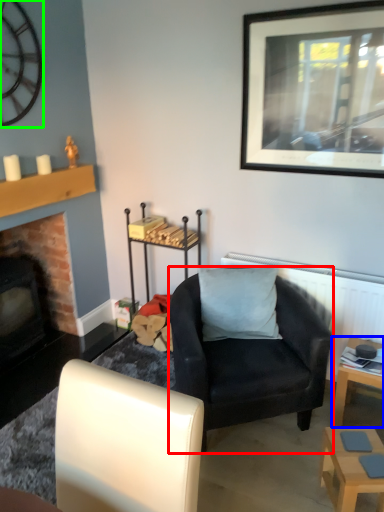
Question: Based on their relative distances, which object is nearer to chair (highlighted by a red box)? Choose from table (highlighted by a blue box) and clock (highlighted by a green box).

Choices:
 (A) table
 (B) clock

Answer: (A)